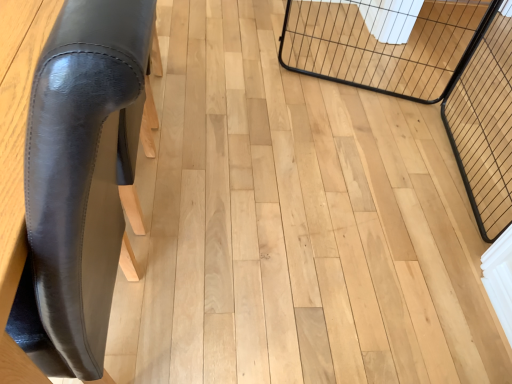
Question: Relative to black wire cage at upper right, the second cage in the right-to-left sequence, is black wire mesh cage at right, which ranks as the 1th cage in right-to-left order, in front or behind?

Choices:
 (A) front
 (B) behind

Answer: (A)

Question: Is black wire mesh cage at right, the second cage in the left-to-right sequence, bigger or smaller than black wire cage at upper right, the second cage in the right-to-left sequence?

Choices:
 (A) big
 (B) small

Answer: (A)

Question: Which object is positioned closest to the black wire cage at upper right, acting as the 1th cage starting from the left?

Choices:
 (A) black wire mesh cage at right, the second cage in the left-to-right sequence
 (B) black leather chair at left

Answer: (A)

Question: Which object is positioned closest to the black wire cage at upper right, the second cage in the right-to-left sequence?

Choices:
 (A) black wire mesh cage at right, the second cage in the left-to-right sequence
 (B) black leather chair at left

Answer: (A)